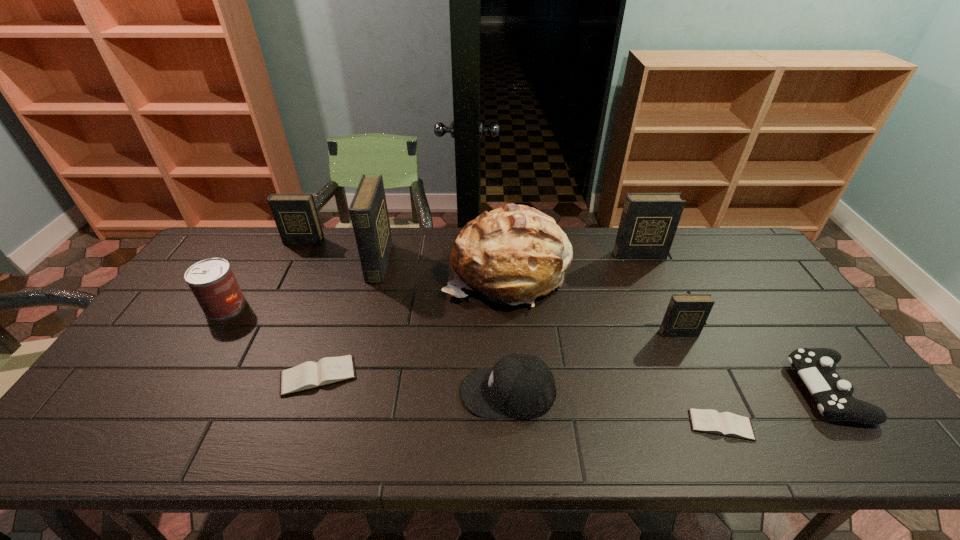
Find the location of `free spot that satisfies the following two spatial constraints: 1. on the front side of the nearest diary; 2. on the left side of the can`. free spot that satisfies the following two spatial constraints: 1. on the front side of the nearest diary; 2. on the left side of the can is located at coordinates (152, 425).